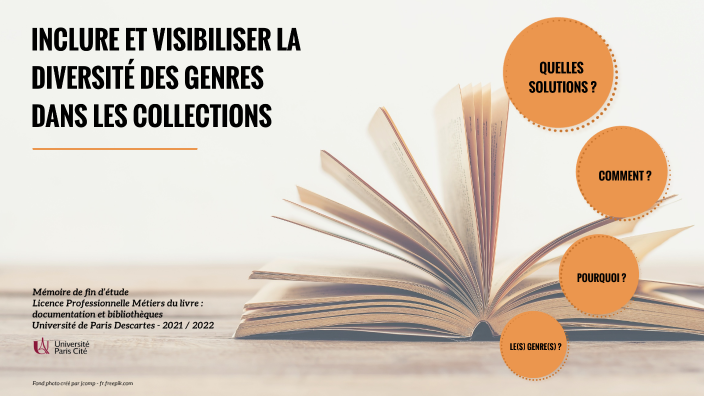
Locate an element on the screen. This screenshot has width=704, height=396. photo of book is located at coordinates (469, 320).